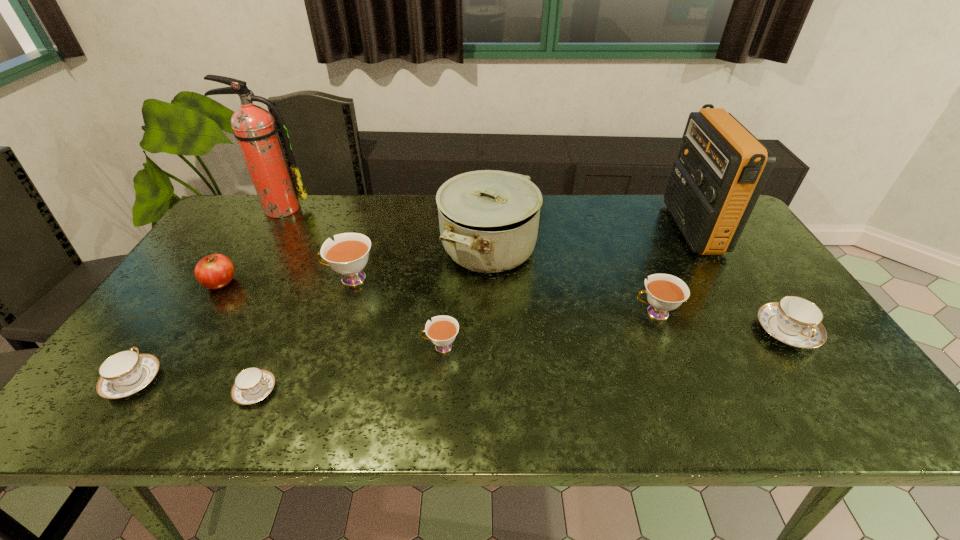
Identify the location of vacant space located 0.130m on the left of the eighth shortest object. 397,248.

Identify the location of vacant area located on the side of the seventh shortest object with the handle. (213, 279).

Identify the location of vacant space positioned 0.200m on the side of the seventh shortest object with the handle. This screenshot has width=960, height=540. (252, 279).

This screenshot has width=960, height=540. Identify the location of free location located 0.080m on the side of the seventh shortest object with the handle. click(295, 279).

Find the location of a particular element. vacant point located 0.260m on the front of the red apple is located at coordinates (161, 375).

Find the location of a particular element. This screenshot has height=540, width=960. free space located 0.200m on the side of the rightmost white teacup with the handle is located at coordinates click(x=554, y=313).

The height and width of the screenshot is (540, 960). I want to click on vacant space located on the side of the rightmost white teacup with the handle, so click(500, 313).

You are a GUI agent. You are given a task and a screenshot of the screen. Output one action in this format:
    pyautogui.click(x=<x>, y=<y>)
    Task: Click on the vacant space located on the side of the rightmost white teacup with the handle
    The image size is (960, 540).
    Given the screenshot: What is the action you would take?
    pyautogui.click(x=577, y=313)

In order to click on free point located on the side with the handle of the rightmost teacup in this screenshot , I will do `click(845, 417)`.

Find the location of a particular element. vacant space located on the side of the smallest white teacup with the handle is located at coordinates (272, 347).